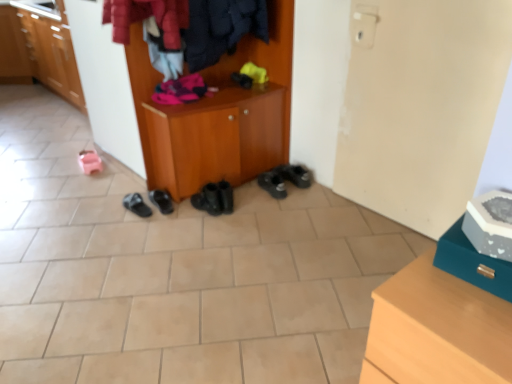
The image size is (512, 384). I want to click on vacant space behind black rubber sandals at center, which appears as the second footwear when viewed from the left, so click(131, 190).